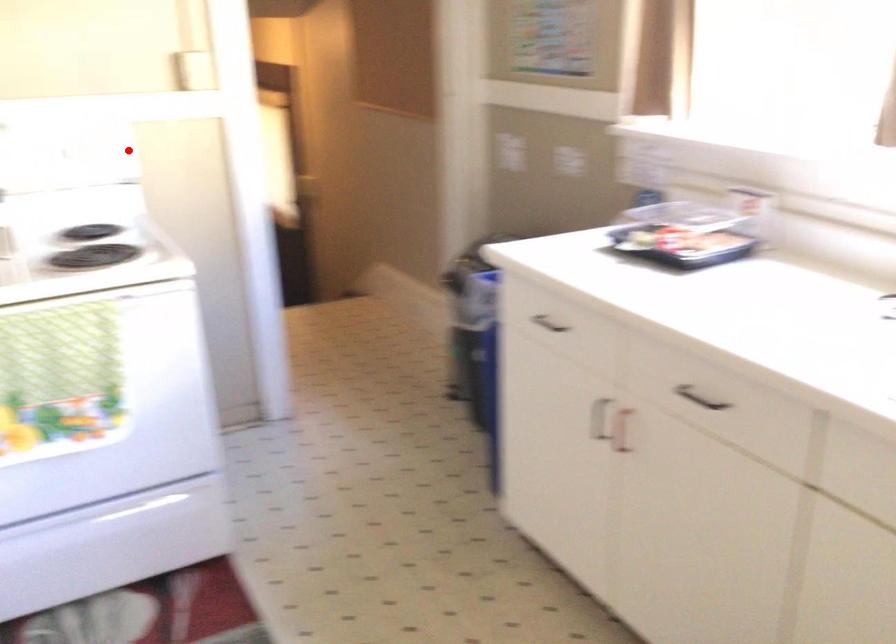
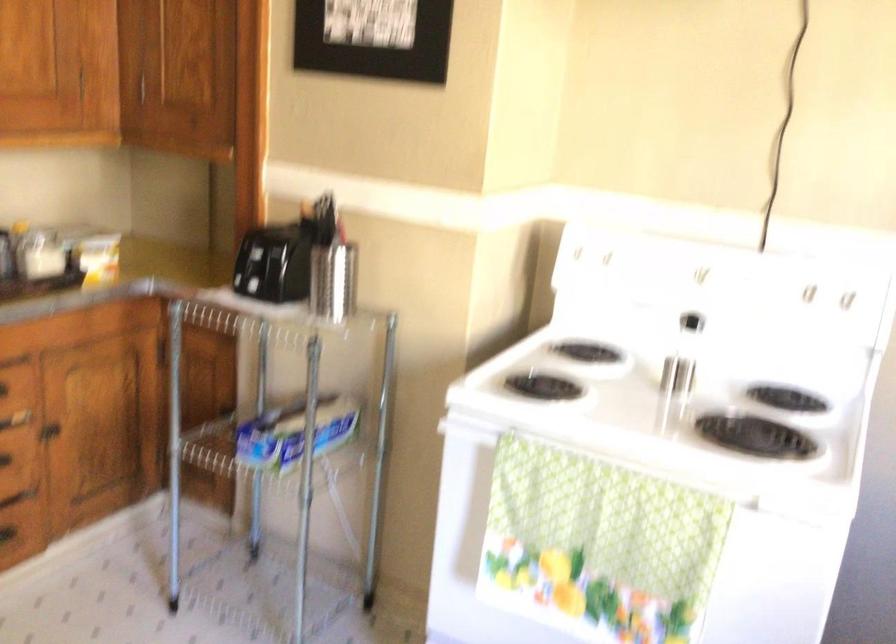
Question: I am providing you with two images of the same scene from different viewpoints. A red point is shown in image1. For the corresponding object point in image2, is it positioned nearer or farther from the camera?

Choices:
 (A) Nearer
 (B) Farther

Answer: (A)